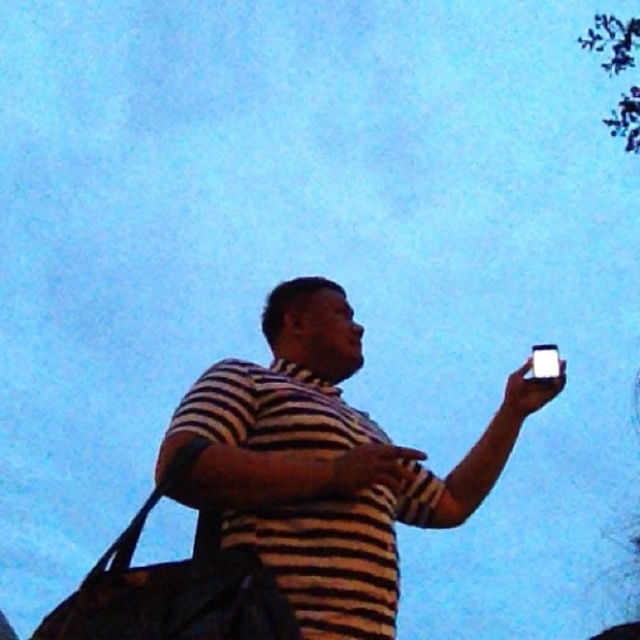
You are a photographer trying to capture the striped fabric shirt at center in your shot. The camera you are using has a focal length of 50mm. If you want to ensure the shirt is in focus, which part of the scene should you focus on?

→ The striped fabric shirt at center is located at point (324, 465), so you should focus on the area around those coordinates to ensure the shirt is in focus.

You are a photographer trying to capture the striped fabric shirt at center and the white glossy smartphone at upper right in a single shot. Based on their positions, which object should you focus on first to ensure both are in focus?

The striped fabric shirt at center is closer to the viewer than the white glossy smartphone at upper right, so you should focus on the striped fabric shirt at center first to ensure both are in focus.

You are a photographer trying to capture the striped fabric shirt at center and the white glossy smartphone at upper right in the same frame. Based on their positions, will the smartphone appear above or below the shirt in the photo?

The striped fabric shirt at center is positioned under the white glossy smartphone at upper right, so the smartphone will appear above the shirt in the photo.